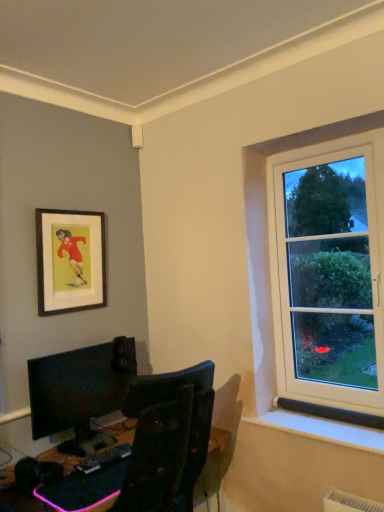
Question: From the image's perspective, does black plastic desk at lower left appear higher than matte black monitor at lower left?

Choices:
 (A) no
 (B) yes

Answer: (A)

Question: Could matte black monitor at lower left be considered to be inside black plastic desk at lower left?

Choices:
 (A) yes
 (B) no

Answer: (B)

Question: Does black plastic desk at lower left have a larger size compared to matte black monitor at lower left?

Choices:
 (A) yes
 (B) no

Answer: (B)

Question: Considering the relative sizes of black plastic desk at lower left and matte black monitor at lower left in the image provided, is black plastic desk at lower left smaller than matte black monitor at lower left?

Choices:
 (A) no
 (B) yes

Answer: (B)

Question: Could you tell me if black plastic desk at lower left is turned towards matte black monitor at lower left?

Choices:
 (A) yes
 (B) no

Answer: (B)

Question: Would you say black plastic desk at lower left is to the left or to the right of wooden framed poster at upper left in the picture?

Choices:
 (A) right
 (B) left

Answer: (A)

Question: Relative to wooden framed poster at upper left, is black plastic desk at lower left in front or behind?

Choices:
 (A) front
 (B) behind

Answer: (A)

Question: From a real-world perspective, is black plastic desk at lower left physically located above or below wooden framed poster at upper left?

Choices:
 (A) above
 (B) below

Answer: (B)

Question: Is black plastic desk at lower left inside the boundaries of wooden framed poster at upper left, or outside?

Choices:
 (A) outside
 (B) inside

Answer: (A)

Question: Considering their positions, is black plastic keyboard at lower center located in front of or behind black plastic desk at lower left?

Choices:
 (A) behind
 (B) front

Answer: (A)

Question: Considering the positions of black plastic keyboard at lower center and black plastic desk at lower left in the image, is black plastic keyboard at lower center wider or thinner than black plastic desk at lower left?

Choices:
 (A) wide
 (B) thin

Answer: (B)

Question: From the image's perspective, is black plastic keyboard at lower center positioned above or below black plastic desk at lower left?

Choices:
 (A) below
 (B) above

Answer: (B)

Question: Choose the correct answer: Is black plastic keyboard at lower center inside black plastic desk at lower left or outside it?

Choices:
 (A) outside
 (B) inside

Answer: (A)

Question: Is wooden framed poster at upper left taller or shorter than black plastic desk at lower left?

Choices:
 (A) short
 (B) tall

Answer: (B)

Question: Does point (89, 226) appear closer or farther from the camera than point (198, 501)?

Choices:
 (A) farther
 (B) closer

Answer: (A)